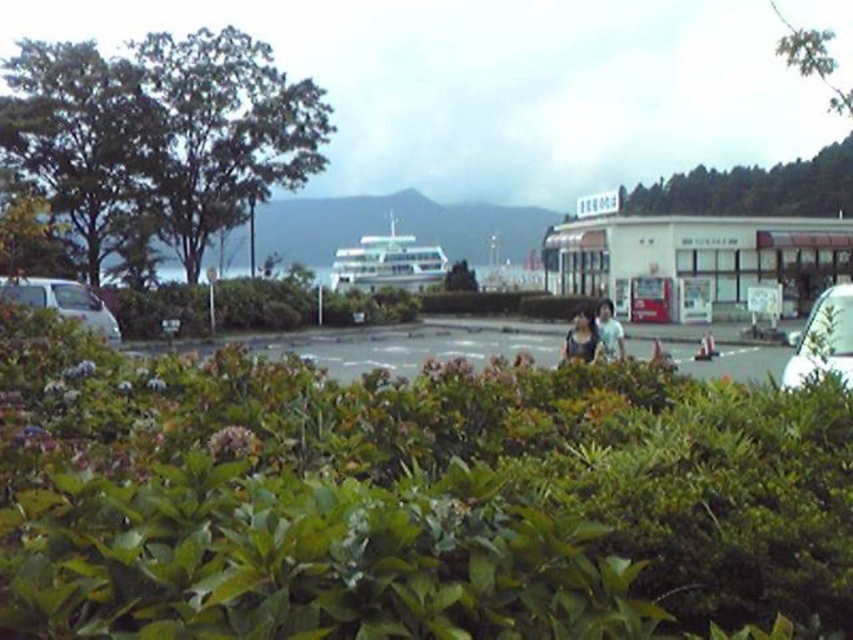
Question: Which object appears closest to the camera in this image?

Choices:
 (A) white matte person at center
 (B) green leafy bush at center
 (C) light brown fabric bag at center
 (D) white matte van at left

Answer: (B)

Question: Is white glossy car at right to the left of white matte person at center from the viewer's perspective?

Choices:
 (A) no
 (B) yes

Answer: (A)

Question: Which of these objects is positioned closest to the white glossy car at right?

Choices:
 (A) white matte van at left
 (B) green leafy bush at center
 (C) white matte person at center
 (D) light brown fabric bag at center

Answer: (B)

Question: Does white matte van at left have a smaller size compared to light brown fabric bag at center?

Choices:
 (A) yes
 (B) no

Answer: (A)

Question: Among these objects, which one is farthest from the camera?

Choices:
 (A) green leafy bush at center
 (B) white matte van at left
 (C) white glossy car at right
 (D) white matte person at center

Answer: (B)

Question: Can you confirm if green leafy bush at center is positioned to the left of white matte person at center?

Choices:
 (A) no
 (B) yes

Answer: (B)